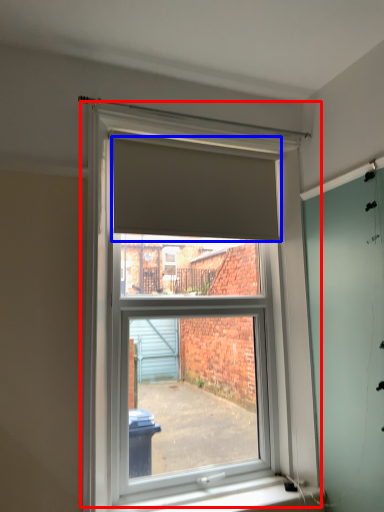
Question: Which object is further to the camera taking this photo, window (highlighted by a red box) or blind (highlighted by a blue box)?

Choices:
 (A) window
 (B) blind

Answer: (B)